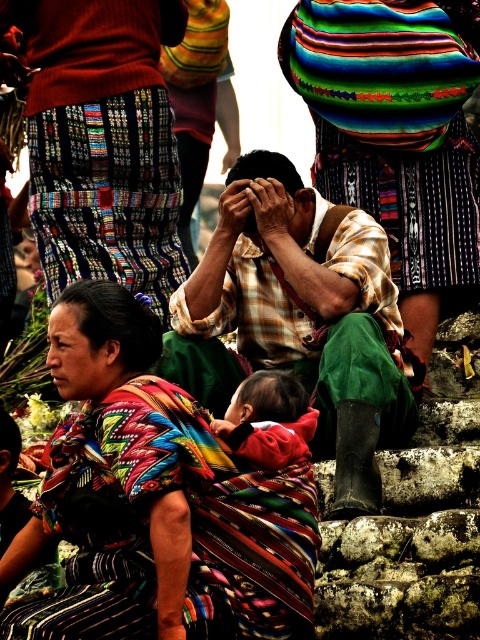
Question: Does red fabric baby at center appear under matte black forehead at center?

Choices:
 (A) no
 (B) yes

Answer: (B)

Question: Which of the following is the farthest from the observer?

Choices:
 (A) (75, 314)
 (B) (283, 563)
 (C) (279, 435)

Answer: (A)

Question: Which object is farther from the camera taking this photo?

Choices:
 (A) matte black forehead at center
 (B) multicolored woven fabric at lower left

Answer: (A)

Question: Can you confirm if multicolored woven fabric at lower left is positioned to the right of red fabric baby at center?

Choices:
 (A) yes
 (B) no

Answer: (B)

Question: Which object is the closest to the matte black forehead at center?

Choices:
 (A) red fabric baby at center
 (B) multicolored woven fabric at lower left

Answer: (B)

Question: Does multicolored woven fabric at lower left appear under red fabric baby at center?

Choices:
 (A) yes
 (B) no

Answer: (A)